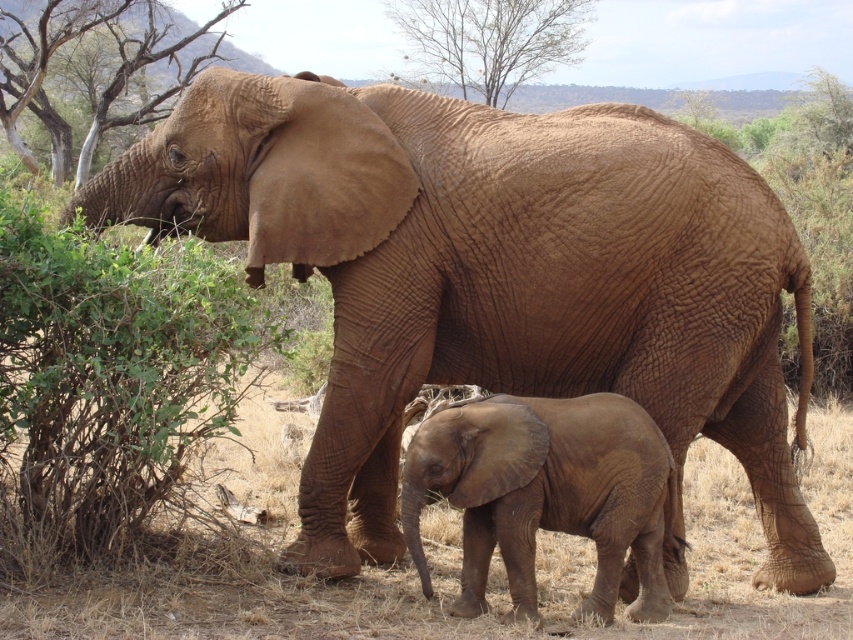
Looking at this image, you are a bird looking for a place to perch. You see the brown bark tree at left and the bare wood tree at upper center. Which tree is closer to you?

The brown bark tree at left is closer to you because it is in front of the bare wood tree at upper center.

You are a safari guide leading a tour and want to point out the matte brown elephant at lower center and the brown bark tree at left. From your position, which object is closer to you?

The matte brown elephant at lower center is closer to you because it is positioned in front of the brown bark tree at left.

You are a photographer trying to capture a photo of the matte brown elephant at lower center and the bare wood tree at upper center. Which object should you focus on first if you want to include both in your shot without moving the camera?

The matte brown elephant at lower center is taller than the bare wood tree at upper center, so you should focus on the matte brown elephant at lower center first to ensure it fits within the frame while also capturing the smaller tree.